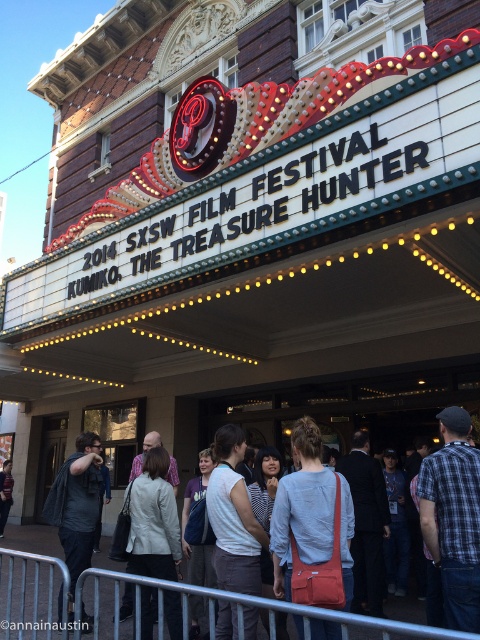
Looking at this image, can you confirm if plaid fabric shirt at center is shorter than light gray cotton shirt at center?

In fact, plaid fabric shirt at center may be taller than light gray cotton shirt at center.

Measure the distance between plaid fabric shirt at center and light gray cotton shirt at center.

4.00 meters

You are a GUI agent. You are given a task and a screenshot of the screen. Output one action in this format:
    pyautogui.click(x=<x>, y=<y>)
    Task: Click on the plaid fabric shirt at center
    Image resolution: width=480 pixels, height=640 pixels.
    Given the screenshot: What is the action you would take?
    pyautogui.click(x=454, y=516)

Image resolution: width=480 pixels, height=640 pixels. What are the coordinates of `plaid fabric shirt at center` in the screenshot? It's located at (454, 516).

Does plaid fabric shirt at center have a larger size compared to light beige jacket at center?

No.

Does plaid fabric shirt at center have a greater height compared to light beige jacket at center?

No.

Does point (444, 540) come farther from viewer compared to point (129, 548)?

No, it is in front of (129, 548).

I want to click on plaid fabric shirt at center, so click(454, 516).

Which is below, light beige jacket at center or dark gray fabric jacket at center?

Positioned lower is dark gray fabric jacket at center.

Consider the image. Measure the distance between point [165,568] and camera.

They are 81.87 feet apart.

Where is `light beige jacket at center`? This screenshot has width=480, height=640. light beige jacket at center is located at coordinates (154, 520).